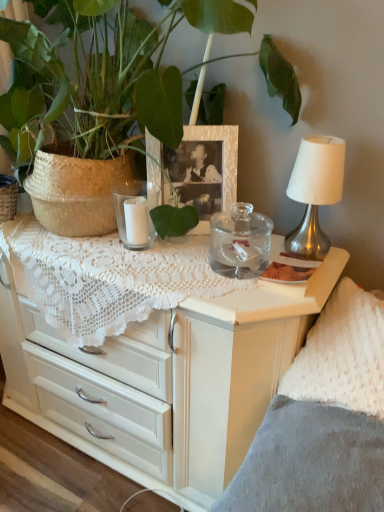
Image resolution: width=384 pixels, height=512 pixels. I want to click on free point above gray fabric at lower right (from a real-world perspective), so click(x=286, y=470).